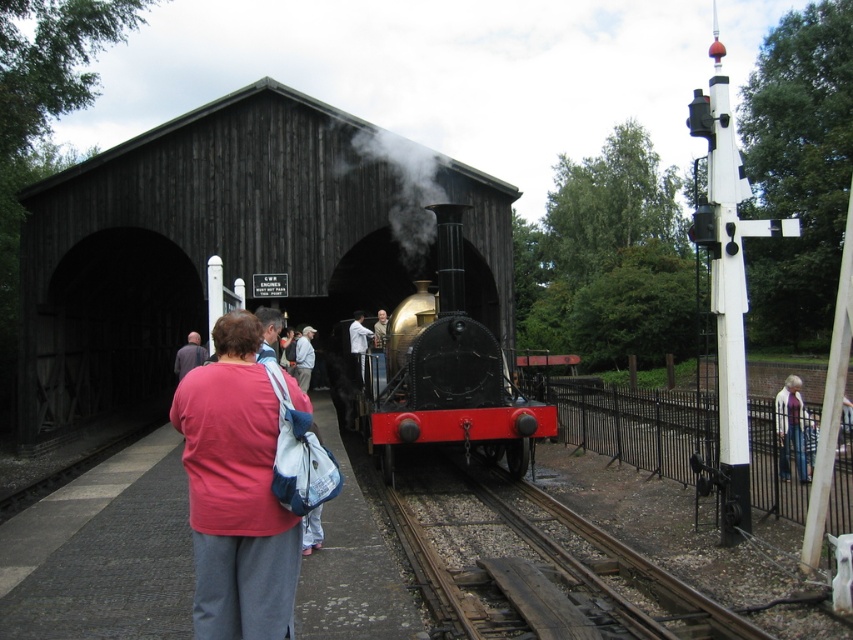
You are a photographer at the railway station. You want to take a photo of the two people wearing the light blue denim jacket at center and white shirt at center. Which one will appear taller in the photo?

The light blue denim jacket at center is not as tall as the white shirt at center, so the person wearing the white shirt at center will appear taller in the photo.